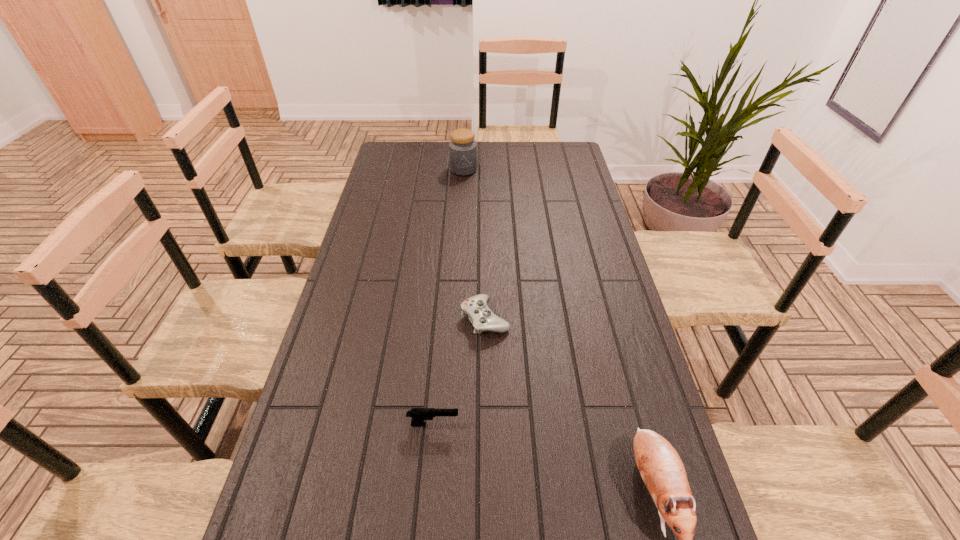
At what (x,y) coordinates should I click in order to perform the action: click on the tallest object. Please return your answer as a coordinate pair (x, y). This screenshot has height=540, width=960. Looking at the image, I should click on (462, 148).

This screenshot has height=540, width=960. Identify the location of jar. (462, 148).

Identify the location of the second nearest object. This screenshot has width=960, height=540. (418, 415).

Find the location of a particular element. Image resolution: width=960 pixels, height=540 pixels. control is located at coordinates (482, 318).

Identify the location of vacant space located on the surface of the tallest object near the warning symbol. The image size is (960, 540). (463, 190).

Locate an element on the screen. The width and height of the screenshot is (960, 540). vacant space situated 0.350m on the front-facing side of the third farthest object is located at coordinates (607, 424).

Identify the location of vacant area situated on the front of the control. This screenshot has height=540, width=960. (486, 354).

You are a GUI agent. You are given a task and a screenshot of the screen. Output one action in this format:
    pyautogui.click(x=<x>, y=<y>)
    Task: Click on the object located at the far edge
    
    Given the screenshot: What is the action you would take?
    pyautogui.click(x=462, y=148)

This screenshot has height=540, width=960. I want to click on free spot at the left edge of the desktop, so click(x=390, y=198).

Identify the location of free space at the right edge of the desktop. (559, 170).